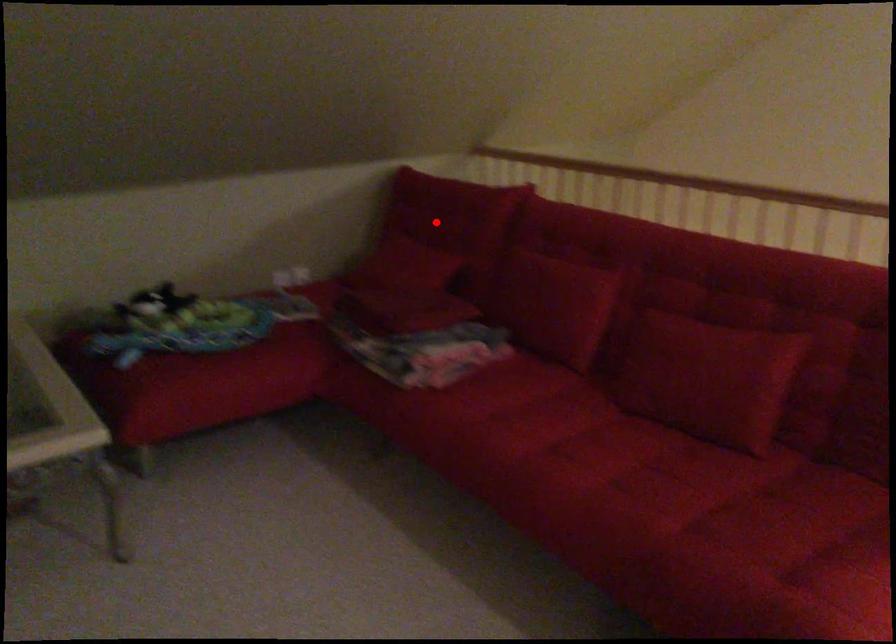
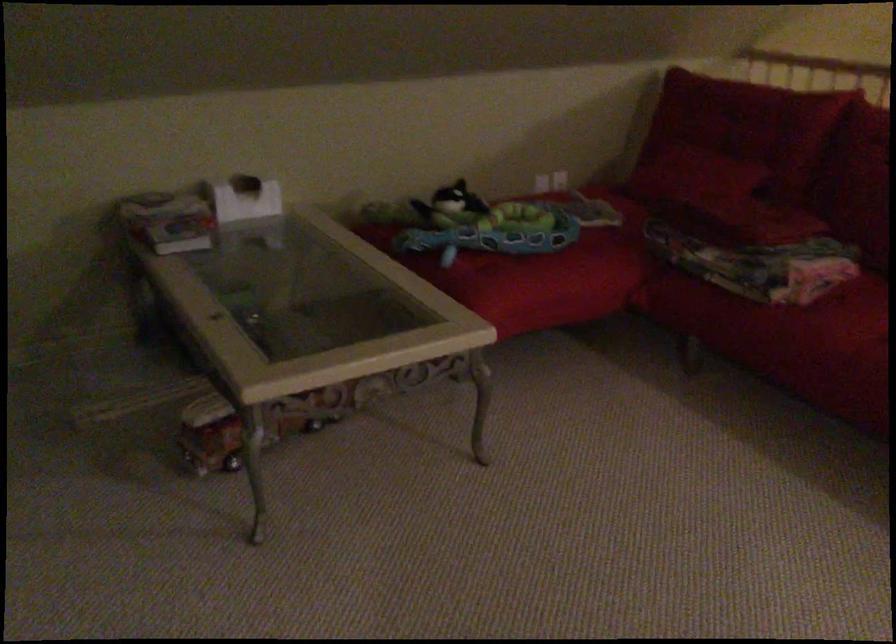
Question: A red point is marked in image1. In image2, is the corresponding 3D point closer to the camera or farther? Reply with the corresponding letter.

Choices:
 (A) The corresponding 3D point is closer.
 (B) The corresponding 3D point is farther.

Answer: (A)